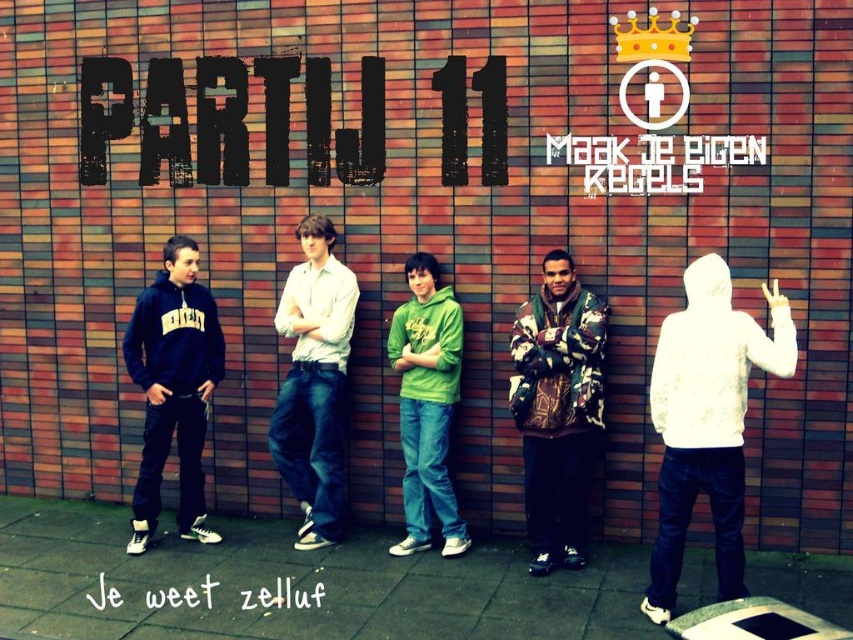
You are a photographer trying to capture both the white hoodie at center and the camouflage jacket at center in the same frame. Based on their heights, which one should you focus on to ensure both are visible without cropping?

The white hoodie at center is not as tall as the camouflage jacket at center, so you should focus on the camouflage jacket at center to ensure both are visible without cropping.